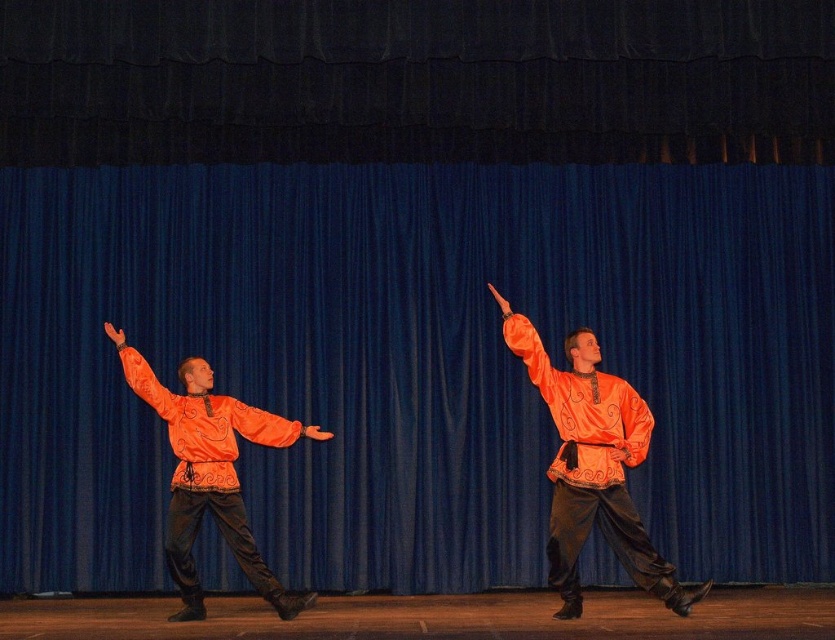
Is orange satin shirt at center thinner than orange satin hand at upper center?

In fact, orange satin shirt at center might be wider than orange satin hand at upper center.

Between orange satin shirt at center and orange satin hand at upper center, which one is positioned higher?

Positioned higher is orange satin hand at upper center.

Which is in front, point (606, 483) or point (499, 298)?

Point (499, 298) is more forward.

Where is `orange satin shirt at center`? The height and width of the screenshot is (640, 835). orange satin shirt at center is located at coordinates (593, 467).

Is point (651, 579) behind point (170, 506)?

No, (651, 579) is in front of (170, 506).

Who is positioned more to the left, orange satin shirt at center or satin orange robe at left?

Positioned to the left is satin orange robe at left.

Is point (570, 413) positioned behind point (231, 554)?

That is False.

At what (x,y) coordinates should I click in order to perform the action: click on orange satin shirt at center. Please return your answer as a coordinate pair (x, y). Image resolution: width=835 pixels, height=640 pixels. Looking at the image, I should click on (593, 467).

Is orange satin shirt at center to the right of orange fabric hand at center from the viewer's perspective?

Correct, you'll find orange satin shirt at center to the right of orange fabric hand at center.

Can you confirm if orange satin shirt at center is thinner than orange fabric hand at center?

Incorrect, orange satin shirt at center's width is not less than orange fabric hand at center's.

Which is behind, point (548, 522) or point (104, 324)?

Point (548, 522)

Find the location of a particular element. The width and height of the screenshot is (835, 640). orange satin shirt at center is located at coordinates (593, 467).